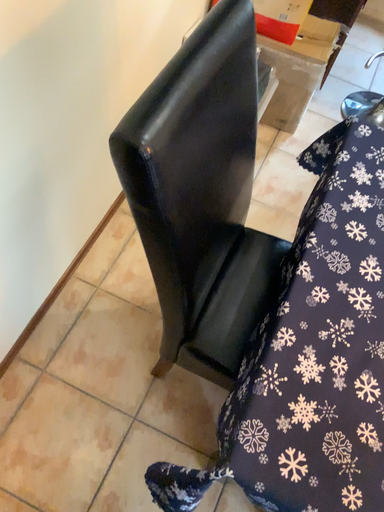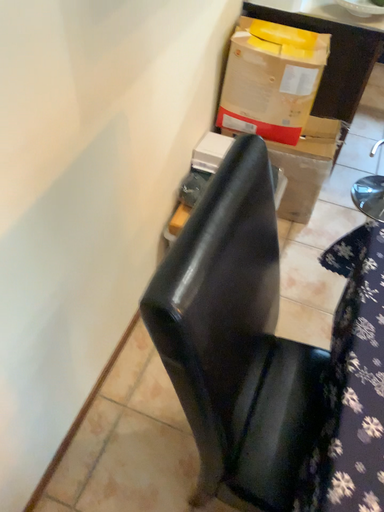
Question: Which way did the camera rotate in the video?

Choices:
 (A) rotated upward
 (B) rotated downward

Answer: (A)